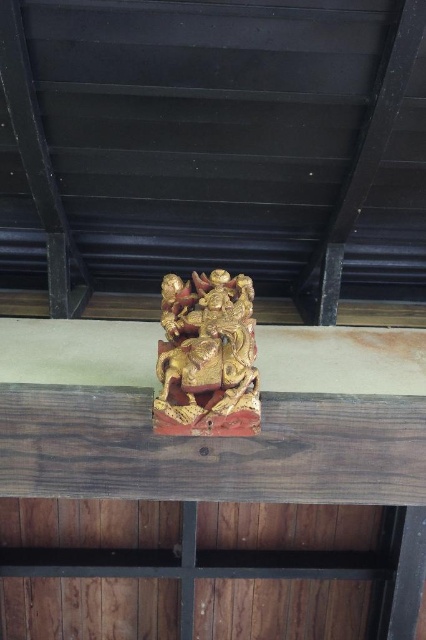
Question: Which of the following is the closest to the observer?

Choices:
 (A) (230, 349)
 (B) (123, 401)

Answer: (A)

Question: Considering the relative positions of wooden beam at center and gold polished wood carving at upper center in the image provided, where is wooden beam at center located with respect to gold polished wood carving at upper center?

Choices:
 (A) right
 (B) left

Answer: (A)

Question: Can you confirm if wooden beam at center is bigger than gold polished wood carving at upper center?

Choices:
 (A) yes
 (B) no

Answer: (A)

Question: Which point is farther from the camera taking this photo?

Choices:
 (A) (100, 406)
 (B) (176, 307)

Answer: (B)

Question: Is wooden beam at center positioned in front of gold polished wood carving at upper center?

Choices:
 (A) yes
 (B) no

Answer: (B)

Question: Which point is closer to the camera?

Choices:
 (A) (402, 436)
 (B) (206, 296)

Answer: (A)